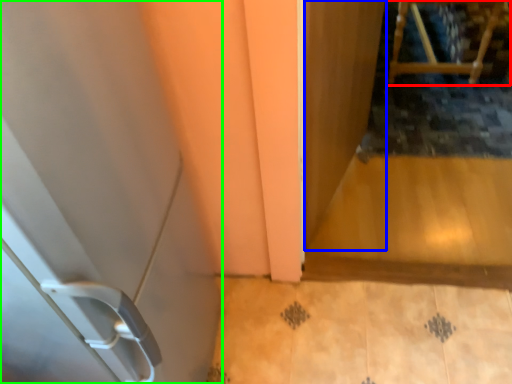
Question: Which object is positioned closest to furniture (highlighted by a red box)? Select from screen door (highlighted by a blue box) and door (highlighted by a green box).

Choices:
 (A) screen door
 (B) door

Answer: (A)